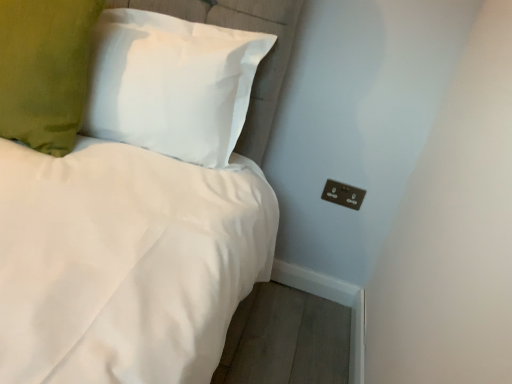
Question: Is green velvet pillow at upper left, arranged as the first pillow when viewed from the left, located within white fabric pillow at upper left, which is counted as the second pillow, starting from the left?

Choices:
 (A) no
 (B) yes

Answer: (A)

Question: Can you see white fabric pillow at upper left, which is counted as the second pillow, starting from the left, touching green velvet pillow at upper left, arranged as the first pillow when viewed from the left?

Choices:
 (A) yes
 (B) no

Answer: (B)

Question: Can you confirm if white fabric pillow at upper left, which is counted as the second pillow, starting from the left, is positioned to the right of green velvet pillow at upper left, the second pillow from the right?

Choices:
 (A) yes
 (B) no

Answer: (A)

Question: Can we say white fabric pillow at upper left, the 1th pillow from the right, lies outside green velvet pillow at upper left, arranged as the first pillow when viewed from the left?

Choices:
 (A) no
 (B) yes

Answer: (B)

Question: From the image's perspective, is white fabric pillow at upper left, which is counted as the second pillow, starting from the left, located beneath green velvet pillow at upper left, arranged as the first pillow when viewed from the left?

Choices:
 (A) no
 (B) yes

Answer: (B)

Question: Can you confirm if white fabric pillow at upper left, the 1th pillow from the right, is wider than green velvet pillow at upper left, the second pillow from the right?

Choices:
 (A) yes
 (B) no

Answer: (B)

Question: Is white fabric pillow at upper left, which is counted as the second pillow, starting from the left, outside of black plastic outlet at lower right?

Choices:
 (A) yes
 (B) no

Answer: (A)

Question: Would you say white fabric pillow at upper left, the 1th pillow from the right, contains black plastic outlet at lower right?

Choices:
 (A) no
 (B) yes

Answer: (A)

Question: From the image's perspective, does white fabric pillow at upper left, the 1th pillow from the right, appear higher than black plastic outlet at lower right?

Choices:
 (A) no
 (B) yes

Answer: (B)

Question: Is white fabric pillow at upper left, which is counted as the second pillow, starting from the left, wider than black plastic outlet at lower right?

Choices:
 (A) no
 (B) yes

Answer: (B)

Question: Is the position of white fabric pillow at upper left, which is counted as the second pillow, starting from the left, less distant than that of black plastic outlet at lower right?

Choices:
 (A) yes
 (B) no

Answer: (A)

Question: Is white fabric pillow at upper left, the 1th pillow from the right, smaller than black plastic outlet at lower right?

Choices:
 (A) no
 (B) yes

Answer: (A)

Question: Is black plastic outlet at lower right facing towards green velvet pillow at upper left, the second pillow from the right?

Choices:
 (A) no
 (B) yes

Answer: (A)